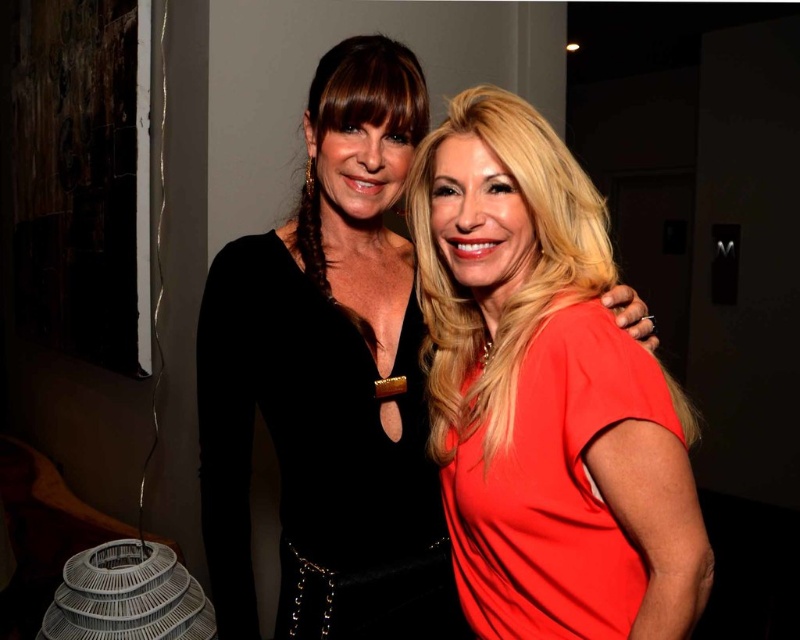
Question: Which of the following is the closest to the observer?

Choices:
 (A) (218, 580)
 (B) (482, 579)
 (C) (392, 145)

Answer: (B)

Question: Which point appears farthest from the camera in this image?

Choices:
 (A) (594, 316)
 (B) (282, 328)

Answer: (B)

Question: Does matte black dress at center come behind matte red dress at right?

Choices:
 (A) no
 (B) yes

Answer: (B)

Question: Based on their relative distances, which object is farther from the velvet black dress at center?

Choices:
 (A) matte black dress at center
 (B) matte red dress at right

Answer: (B)

Question: Is velvet black dress at center bigger than matte red dress at right?

Choices:
 (A) yes
 (B) no

Answer: (A)

Question: Can you confirm if velvet black dress at center is thinner than matte red dress at right?

Choices:
 (A) no
 (B) yes

Answer: (A)